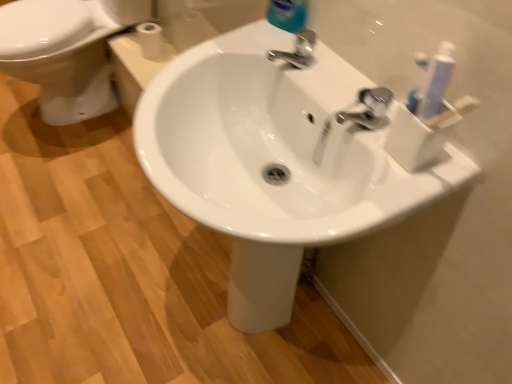
Find the location of a particular element. The height and width of the screenshot is (384, 512). free space in front of polished chrome faucet at upper right, the 2th tap viewed from the back is located at coordinates (384, 176).